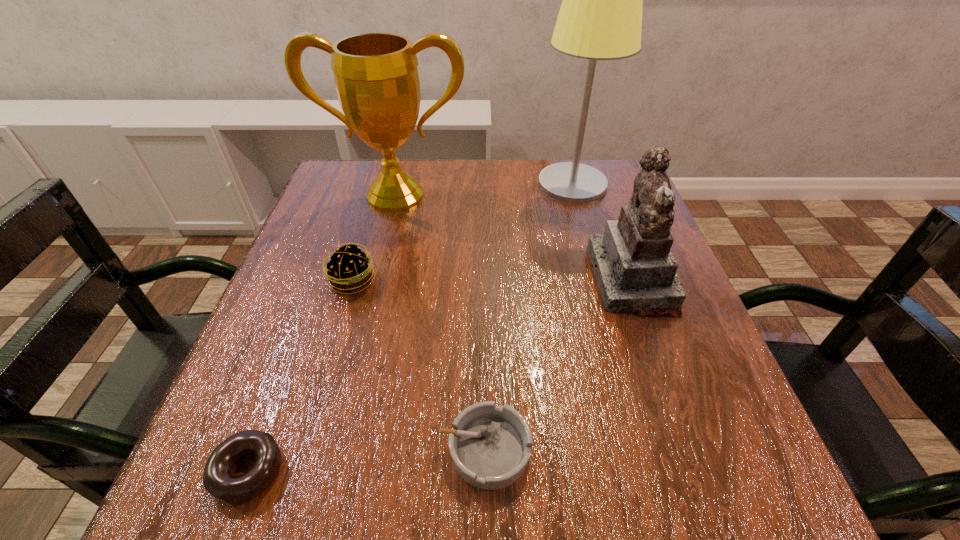
Identify the location of doughnut situated at the left edge. (219, 481).

Locate an element on the screen. The width and height of the screenshot is (960, 540). table lamp that is at the right edge is located at coordinates (600, 18).

Identify the location of figurine present at the right edge. (635, 270).

In order to click on object at the far left corner in this screenshot , I will do `click(376, 77)`.

At what (x,y) coordinates should I click in order to perform the action: click on object that is at the near left corner. Please return your answer as a coordinate pair (x, y). The image size is (960, 540). Looking at the image, I should click on (219, 481).

Locate an element on the screen. The width and height of the screenshot is (960, 540). object present at the far right corner is located at coordinates click(x=600, y=18).

Locate an element on the screen. free space at the far edge is located at coordinates point(492,173).

The image size is (960, 540). In the image, there is a desktop. What are the coordinates of `vacant region at the near edge` in the screenshot? It's located at tap(376, 501).

The image size is (960, 540). I want to click on free space at the left edge of the desktop, so click(332, 247).

Find the location of a particular element. The height and width of the screenshot is (540, 960). vacant space at the right edge of the desktop is located at coordinates (609, 317).